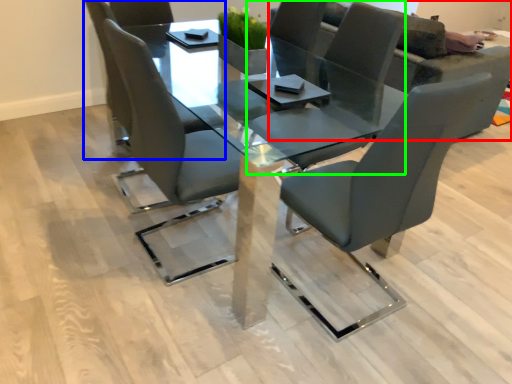
Question: Which is farther away from couch (highlighted by a red box)? chair (highlighted by a blue box) or chair (highlighted by a green box)?

Choices:
 (A) chair
 (B) chair

Answer: (A)